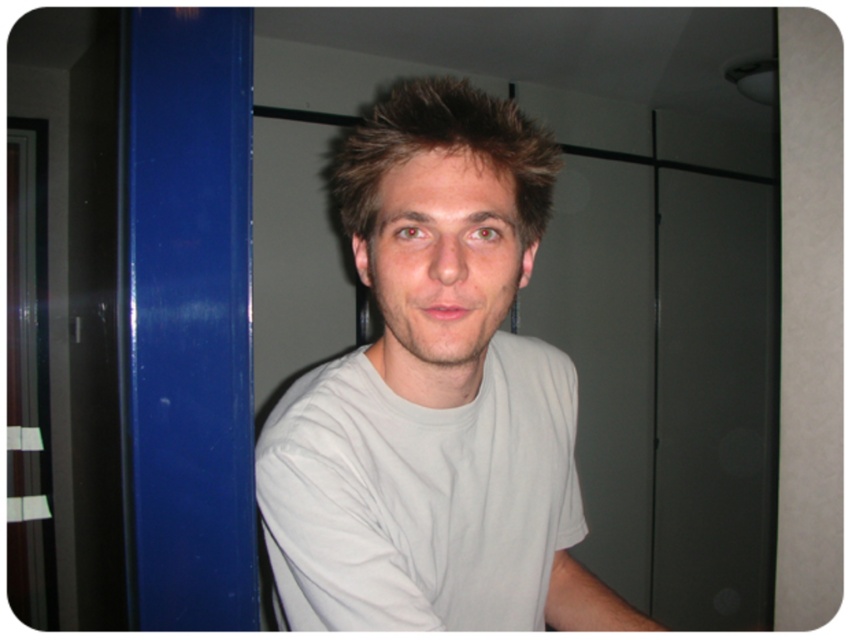
Question: Can you confirm if white cotton shirt at center is positioned to the left of white cotton t-shirt at center?

Choices:
 (A) no
 (B) yes

Answer: (B)

Question: Which object is farther from the camera taking this photo?

Choices:
 (A) spiky brown hair at center
 (B) white cotton shirt at center
 (C) white cotton t-shirt at center

Answer: (C)

Question: Which point is closer to the camera taking this photo?

Choices:
 (A) (544, 589)
 (B) (525, 173)

Answer: (B)

Question: Can you confirm if white cotton shirt at center is wider than white cotton t-shirt at center?

Choices:
 (A) no
 (B) yes

Answer: (B)

Question: Does white cotton t-shirt at center have a lesser width compared to spiky brown hair at center?

Choices:
 (A) yes
 (B) no

Answer: (B)

Question: Which point is closer to the camera?

Choices:
 (A) (517, 212)
 (B) (337, 563)
 (C) (413, 218)

Answer: (C)